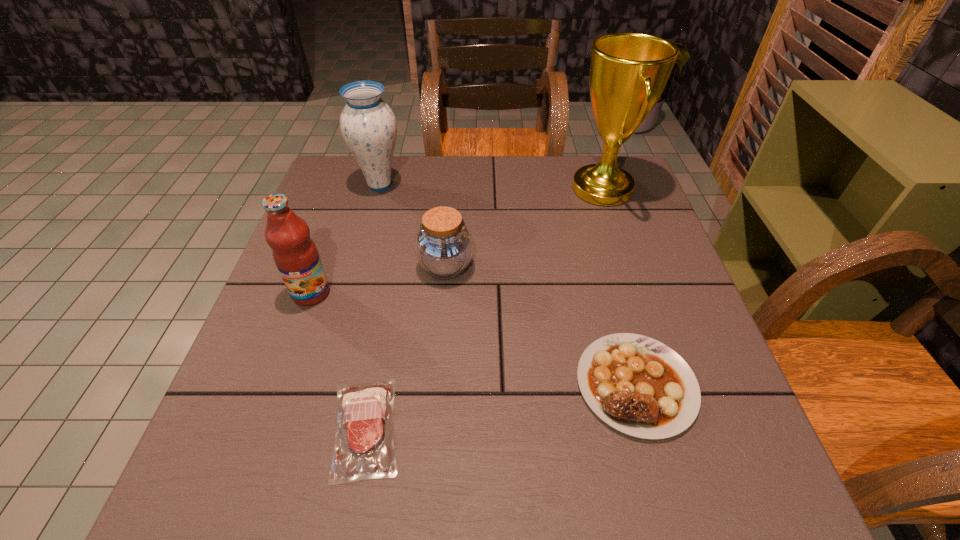
I want to click on fruit juice at the left edge, so (295, 254).

Locate an element on the screen. The image size is (960, 540). award that is at the right edge is located at coordinates pos(628,71).

Where is `steak positioned at the right edge`? steak positioned at the right edge is located at coordinates (639, 386).

At what (x,y) coordinates should I click in order to perform the action: click on object positioned at the far left corner. Please return your answer as a coordinate pair (x, y). The image size is (960, 540). Looking at the image, I should click on click(368, 125).

You are a GUI agent. You are given a task and a screenshot of the screen. Output one action in this format:
    pyautogui.click(x=<x>, y=<y>)
    Task: Click on the object that is at the far right corner
    This screenshot has height=540, width=960.
    Given the screenshot: What is the action you would take?
    pyautogui.click(x=628, y=71)

You are a GUI agent. You are given a task and a screenshot of the screen. Output one action in this format:
    pyautogui.click(x=<x>, y=<y>)
    Task: Click on the free space at the far edge
    This screenshot has height=540, width=960.
    Given the screenshot: What is the action you would take?
    pyautogui.click(x=431, y=198)

This screenshot has height=540, width=960. What are the coordinates of `vacant space at the left edge of the desktop` in the screenshot? It's located at (253, 360).

Identify the location of vacant space at the right edge. (710, 388).

Locate an element on the screen. This screenshot has height=540, width=960. vacant space at the far left corner is located at coordinates click(x=330, y=182).

In the image, there is a desktop. What are the coordinates of `vacant region at the near right corner` in the screenshot? It's located at (761, 502).